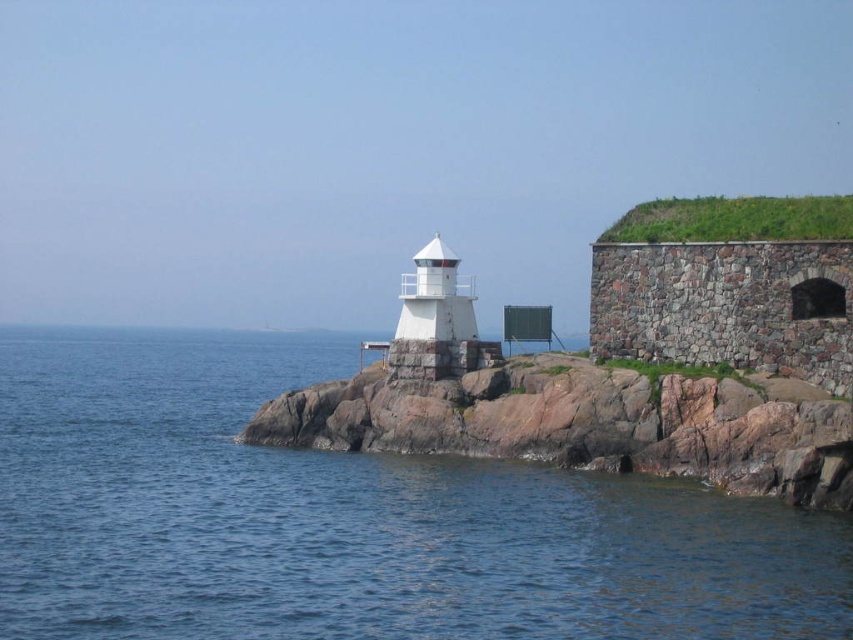
Question: Is blue water at center closer to the viewer compared to white stone lighthouse at center?

Choices:
 (A) yes
 (B) no

Answer: (A)

Question: Which point appears farthest from the camera in this image?

Choices:
 (A) (627, 524)
 (B) (457, 358)

Answer: (B)

Question: Does blue water at center come behind rockysmooth rockat center?

Choices:
 (A) yes
 (B) no

Answer: (B)

Question: Which object appears closest to the camera in this image?

Choices:
 (A) blue water at center
 (B) white stone lighthouse at center

Answer: (A)

Question: In this image, where is rockysmooth rockat center located relative to white stone lighthouse at center?

Choices:
 (A) left
 (B) right

Answer: (B)

Question: Which point is closer to the camera?

Choices:
 (A) blue water at center
 (B) white stone lighthouse at center
 (C) rockysmooth rockat center

Answer: (A)